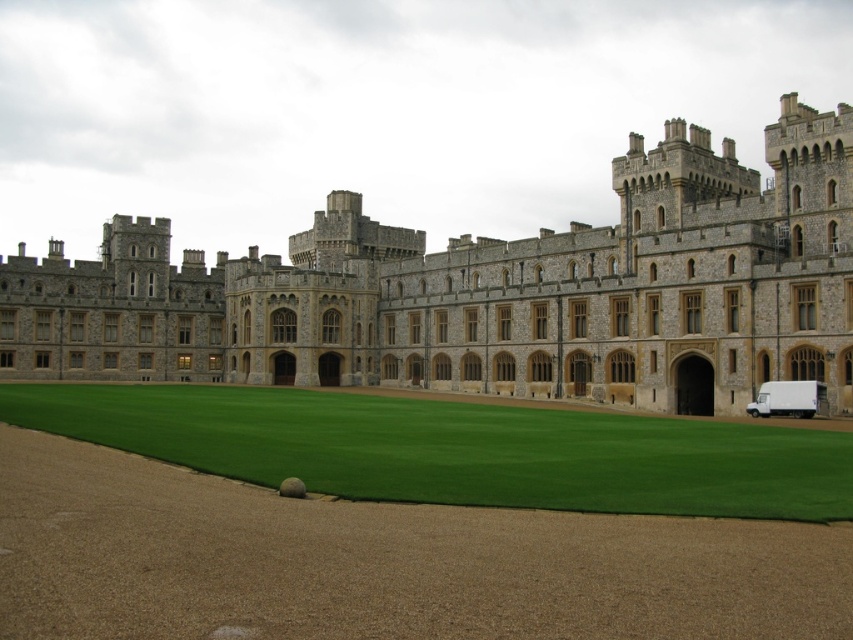
How much distance is there between stone castle at center and white matte van at lower right?

stone castle at center and white matte van at lower right are 144.35 feet apart from each other.

Does stone castle at center have a greater height compared to white matte van at lower right?

Correct, stone castle at center is much taller as white matte van at lower right.

Measure the distance between point (704, 225) and camera.

Point (704, 225) and camera are 73.81 meters apart from each other.

The width and height of the screenshot is (853, 640). I want to click on stone castle at center, so click(x=491, y=291).

Can you confirm if green artificial turf at center is shorter than white matte van at lower right?

Yes.

Is point (599, 502) more distant than point (750, 413)?

No, (599, 502) is closer to viewer.

The height and width of the screenshot is (640, 853). In order to click on green artificial turf at center in this screenshot , I will do [457, 449].

Where is `stone castle at center`? The image size is (853, 640). stone castle at center is located at coordinates (491, 291).

Is stone castle at center shorter than green artificial turf at center?

No.

Describe the element at coordinates (491, 291) in the screenshot. I see `stone castle at center` at that location.

Where is `stone castle at center`? stone castle at center is located at coordinates (491, 291).